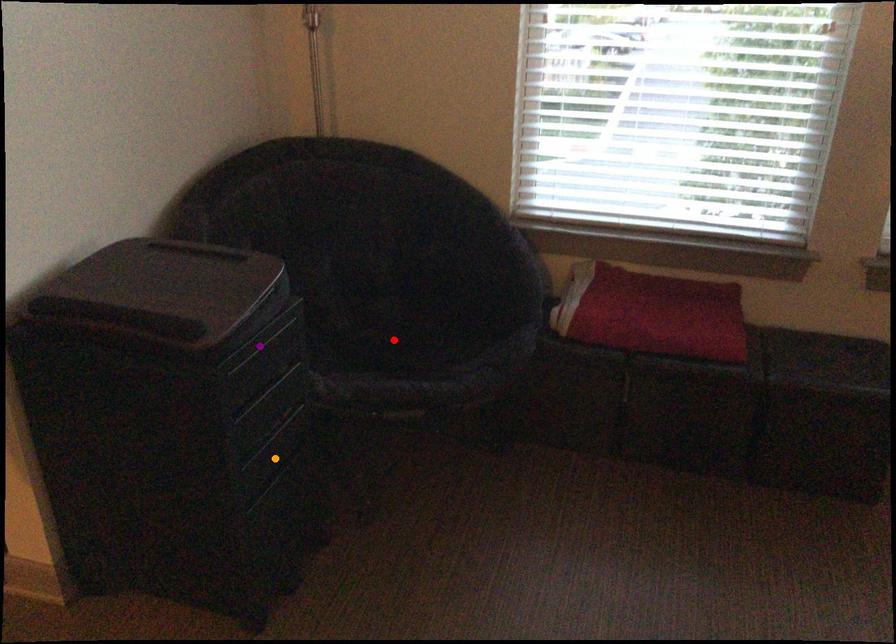
Order these from nearest to farthest:
A) red point
B) orange point
C) purple point

purple point
orange point
red point